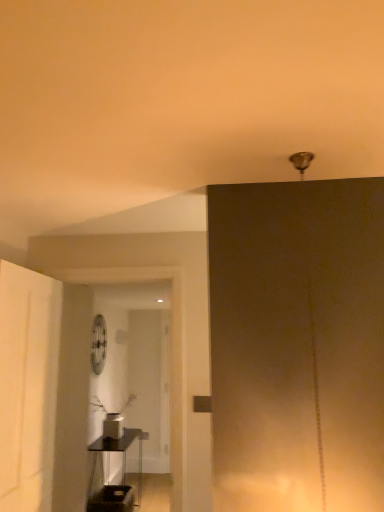
At what (x,y) coordinates should I click in order to perform the action: click on metallic black shelf at lower left. Please return your answer as a coordinate pair (x, y). Image resolution: width=384 pixels, height=512 pixels. Looking at the image, I should click on (117, 451).

What is the approximate width of metallic black shelf at lower left?

metallic black shelf at lower left is 13.39 inches wide.

Describe the element at coordinates (117, 451) in the screenshot. This screenshot has height=512, width=384. I see `metallic black shelf at lower left` at that location.

Image resolution: width=384 pixels, height=512 pixels. Describe the element at coordinates (98, 344) in the screenshot. I see `metallic circular fan at center` at that location.

Find the location of a particular element. metallic circular fan at center is located at coordinates (98, 344).

You are a GUI agent. You are given a task and a screenshot of the screen. Output one action in this format:
    pyautogui.click(x=<x>, y=<y>)
    Task: Click on the metallic black shelf at lower left
    The height and width of the screenshot is (512, 384).
    Given the screenshot: What is the action you would take?
    pyautogui.click(x=117, y=451)

Which object is positioned more to the right, metallic black shelf at lower left or metallic circular fan at center?

From the viewer's perspective, metallic black shelf at lower left appears more on the right side.

Considering the relative positions of metallic black shelf at lower left and metallic circular fan at center in the image provided, is metallic black shelf at lower left behind metallic circular fan at center?

No, the depth of metallic black shelf at lower left is less than that of metallic circular fan at center.

Which is more distant, (141,477) or (91,341)?

The point (141,477) is farther.

From the image's perspective, is metallic black shelf at lower left on top of metallic circular fan at center?

No, from the image's perspective, metallic black shelf at lower left is not on top of metallic circular fan at center.

From the picture: From a real-world perspective, is metallic black shelf at lower left on metallic circular fan at center?

No.

In the scene shown: In terms of width, does metallic black shelf at lower left look wider or thinner when compared to metallic circular fan at center?

metallic black shelf at lower left is wider than metallic circular fan at center.

Considering the relative sizes of metallic black shelf at lower left and metallic circular fan at center in the image provided, is metallic black shelf at lower left taller than metallic circular fan at center?

Correct, metallic black shelf at lower left is much taller as metallic circular fan at center.

Is metallic black shelf at lower left smaller than metallic circular fan at center?

No, metallic black shelf at lower left is not smaller than metallic circular fan at center.

Which is correct: metallic black shelf at lower left is inside metallic circular fan at center, or outside of it?

The correct answer is: outside.

Is metallic black shelf at lower left with metallic circular fan at center?

No, metallic black shelf at lower left is not making contact with metallic circular fan at center.

Is metallic black shelf at lower left facing away from metallic circular fan at center?

metallic black shelf at lower left does not have its back to metallic circular fan at center.

Identify the location of fan above the metallic black shelf at lower left (from a real-world perspective). (98, 344).

Between metallic circular fan at center and metallic black shelf at lower left, which one appears on the left side from the viewer's perspective?

Positioned to the left is metallic circular fan at center.

Which object is further away from the camera taking this photo, metallic circular fan at center or metallic black shelf at lower left?

Positioned behind is metallic circular fan at center.

Which point is more distant from viewer, (104, 323) or (124, 437)?

The point (104, 323) is behind.

From the image's perspective, is metallic circular fan at center located above or below metallic black shelf at lower left?

metallic circular fan at center is situated higher than metallic black shelf at lower left in the image.

From a real-world perspective, does metallic circular fan at center sit lower than metallic black shelf at lower left?

No, from a real-world perspective, metallic circular fan at center is not below metallic black shelf at lower left.

Does metallic circular fan at center have a greater width compared to metallic black shelf at lower left?

No, metallic circular fan at center is not wider than metallic black shelf at lower left.

Can you confirm if metallic circular fan at center is taller than metallic black shelf at lower left?

No.

Is metallic circular fan at center bigger than metallic black shelf at lower left?

Incorrect, metallic circular fan at center is not larger than metallic black shelf at lower left.

Can we say metallic circular fan at center lies outside metallic black shelf at lower left?

metallic circular fan at center lies outside metallic black shelf at lower left's area.

Is metallic circular fan at center positioned far away from metallic black shelf at lower left?

Actually, metallic circular fan at center and metallic black shelf at lower left are a little close together.

Is metallic circular fan at center oriented towards metallic black shelf at lower left?

No, metallic circular fan at center is not turned towards metallic black shelf at lower left.

Can you tell me how much metallic circular fan at center and metallic black shelf at lower left differ in facing direction?

0.916 degrees.

How distant is metallic circular fan at center from metallic black shelf at lower left?

metallic circular fan at center and metallic black shelf at lower left are 33.69 inches apart from each other.

The height and width of the screenshot is (512, 384). Identify the location of fan behind the metallic black shelf at lower left. (98, 344).

This screenshot has width=384, height=512. What are the coordinates of `table in front of the metallic circular fan at center` in the screenshot? It's located at (117, 451).

At what (x,y) coordinates should I click in order to perform the action: click on fan that appears on the left of metallic black shelf at lower left. Please return your answer as a coordinate pair (x, y). This screenshot has height=512, width=384. Looking at the image, I should click on [98, 344].